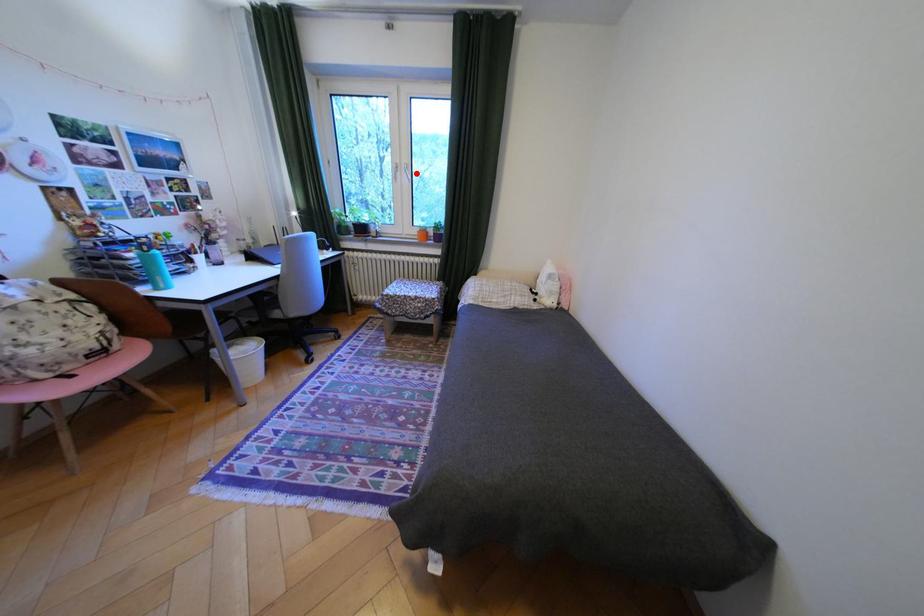
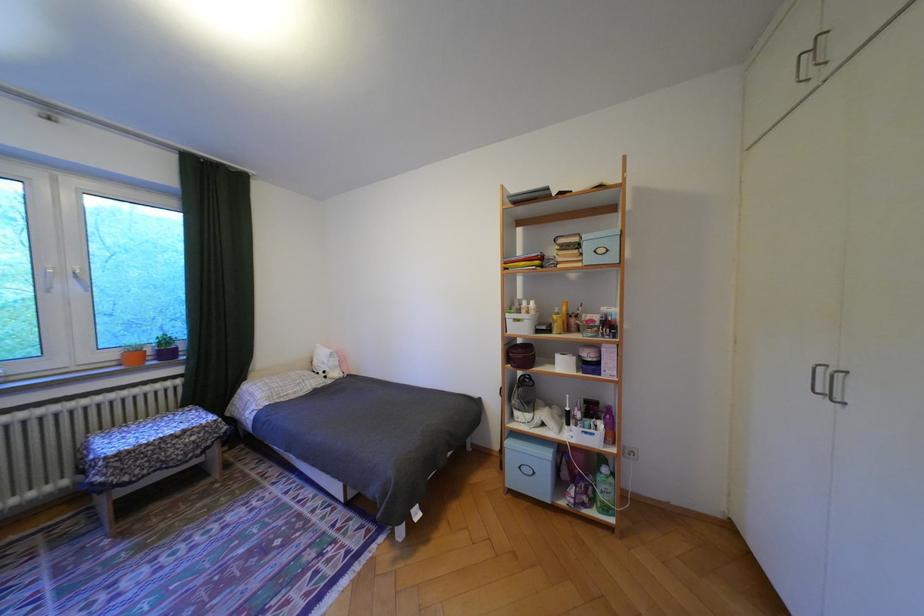
Question: A red point is marked in image1. In image2, is the corresponding 3D point closer to the camera or farther? Reply with the corresponding letter.

Choices:
 (A) The corresponding 3D point is closer.
 (B) The corresponding 3D point is farther.

Answer: (B)